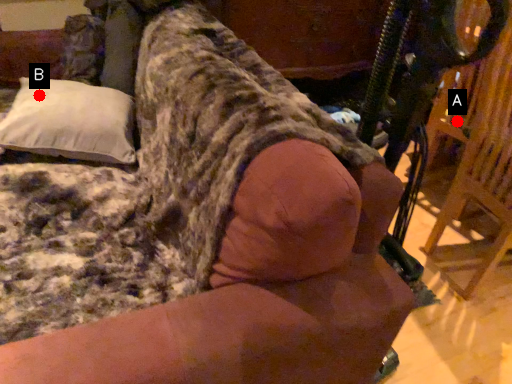
Question: Two points are circled on the image, labeled by A and B beside each circle. Which of the following is the farthest from the observer?

Choices:
 (A) A is further
 (B) B is further

Answer: (A)